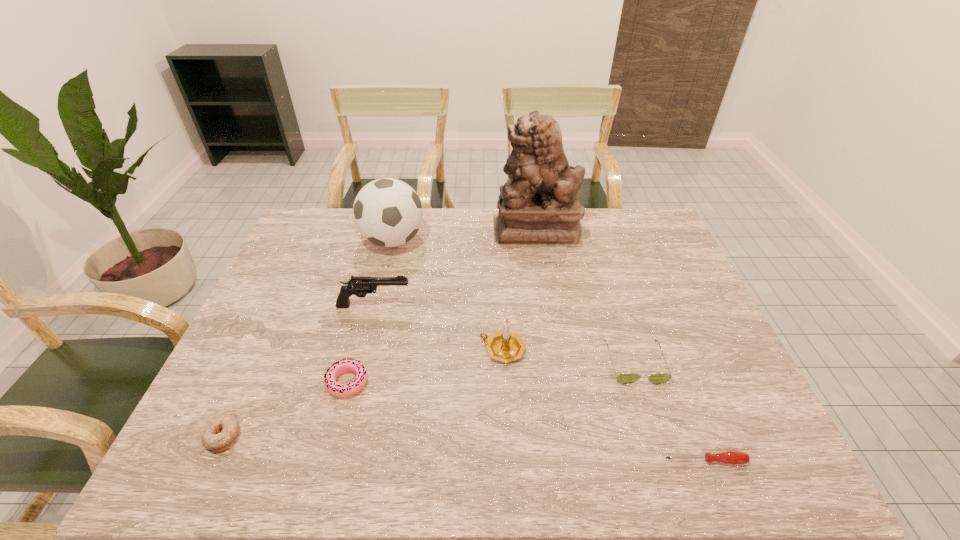
The height and width of the screenshot is (540, 960). In order to click on the tallest object in this screenshot , I will do `click(540, 207)`.

I want to click on the second tallest object, so click(x=387, y=212).

What are the coordinates of `candle holder` in the screenshot? It's located at pyautogui.click(x=504, y=346).

Where is `gun`? gun is located at coordinates (360, 286).

You are a GUI agent. You are given a task and a screenshot of the screen. Output one action in this format:
    pyautogui.click(x=<x>, y=<y>)
    Task: Click on the fifth tallest object
    
    Given the screenshot: What is the action you would take?
    pyautogui.click(x=625, y=378)

Find the location of a particular element. The width and height of the screenshot is (960, 540). the right doughnut is located at coordinates (338, 390).

The height and width of the screenshot is (540, 960). What are the coordinates of `the nearer doughnut` in the screenshot? It's located at [221, 433].

Where is `the seventh farthest object`? Image resolution: width=960 pixels, height=540 pixels. the seventh farthest object is located at coordinates (221, 433).

The image size is (960, 540). I want to click on the nearest object, so click(x=730, y=457).

Identify the location of screwdriver. This screenshot has height=540, width=960. (730, 457).